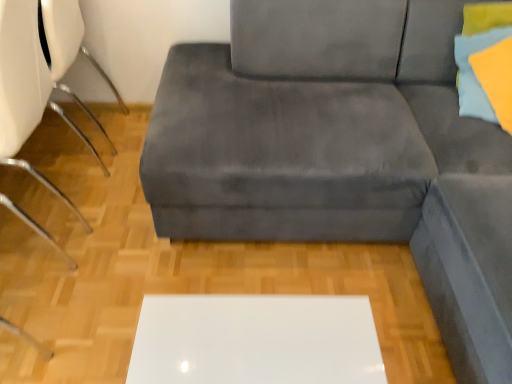
Locate an element on the screen. This screenshot has width=512, height=384. vacant space in between white plastic chair at left and white plastic swivel chair at left is located at coordinates (70, 161).